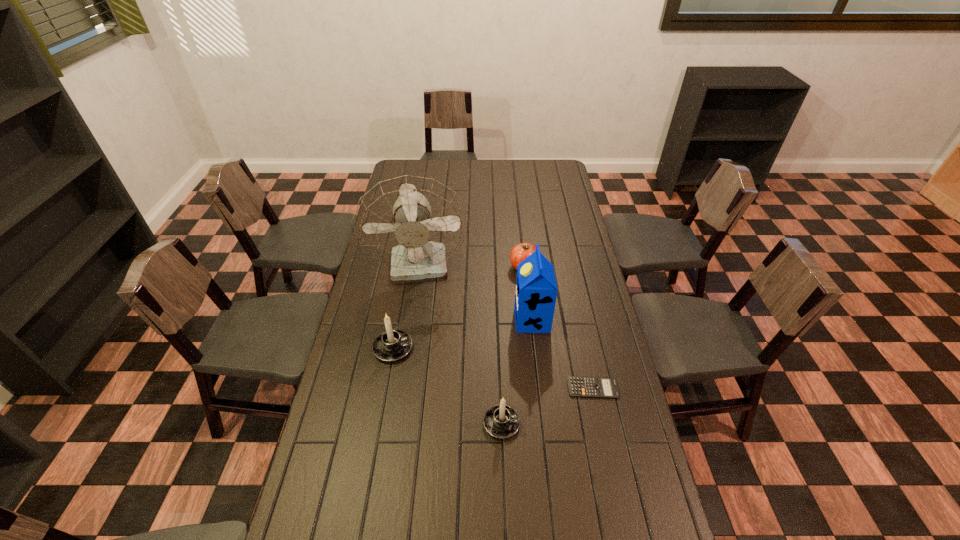
In the image, there is a desktop. Identify the location of blank space at the far edge. This screenshot has width=960, height=540. (499, 182).

At what (x,y) coordinates should I click in order to perform the action: click on vacant region at the left edge of the desktop. Please return your answer as a coordinate pair (x, y). The width and height of the screenshot is (960, 540). Looking at the image, I should click on (399, 321).

Identify the location of vacant space at the right edge of the desktop. (562, 259).

In the image, there is a desktop. Where is `vacant space at the far right corner`? This screenshot has width=960, height=540. vacant space at the far right corner is located at coordinates (568, 180).

In the image, there is a desktop. Find the location of `vacant space at the near right corner`. vacant space at the near right corner is located at coordinates click(625, 527).

Locate an element on the screen. This screenshot has height=540, width=960. vacant point located between the second shortest object and the fourth tallest object is located at coordinates (513, 345).

Find the location of a particular element. This screenshot has height=540, width=960. free space between the nearest object and the apple is located at coordinates (513, 345).

The image size is (960, 540). What are the coordinates of `free space between the farther candle holder and the tallest object` in the screenshot? It's located at (407, 308).

At what (x,y) coordinates should I click in order to perform the action: click on unoccupied position between the apple and the rightmost object. Please return your answer as a coordinate pair (x, y). This screenshot has height=540, width=960. Looking at the image, I should click on (559, 327).

Image resolution: width=960 pixels, height=540 pixels. I want to click on free space that is in between the fifth farthest object and the left candle holder, so click(x=492, y=368).